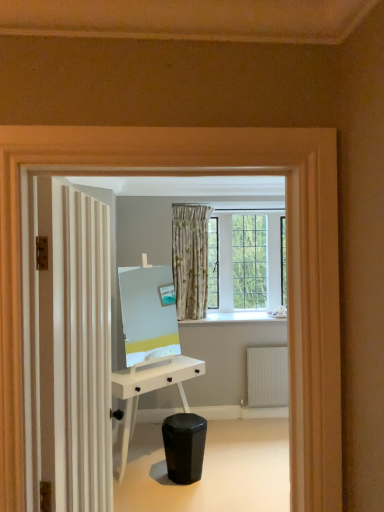
Find the location of `free spot to the left of white ribbed radiator at lower right`. free spot to the left of white ribbed radiator at lower right is located at coordinates (246, 422).